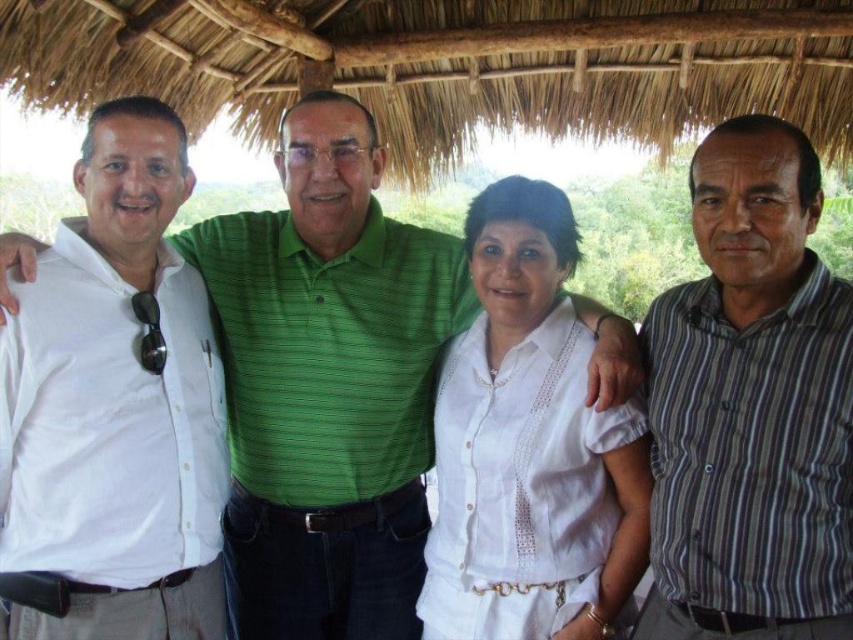
Question: Does white shirt at left have a greater width compared to white cotton blouse at center?

Choices:
 (A) yes
 (B) no

Answer: (B)

Question: Is white shirt at left thinner than striped cotton shirt at right?

Choices:
 (A) no
 (B) yes

Answer: (A)

Question: Estimate the real-world distances between objects in this image. Which object is closer to the white cotton blouse at center?

Choices:
 (A) white shirt at center
 (B) white shirt at left
 (C) striped cotton shirt at right

Answer: (C)

Question: Which of these objects is positioned farthest from the white cotton blouse at center?

Choices:
 (A) white shirt at center
 (B) white shirt at left
 (C) striped cotton shirt at right

Answer: (B)

Question: Based on their relative distances, which object is farther from the striped cotton shirt at right?

Choices:
 (A) white shirt at center
 (B) white cotton blouse at center

Answer: (A)

Question: Observing the image, what is the correct spatial positioning of white shirt at center in reference to white cotton blouse at center?

Choices:
 (A) below
 (B) above

Answer: (B)